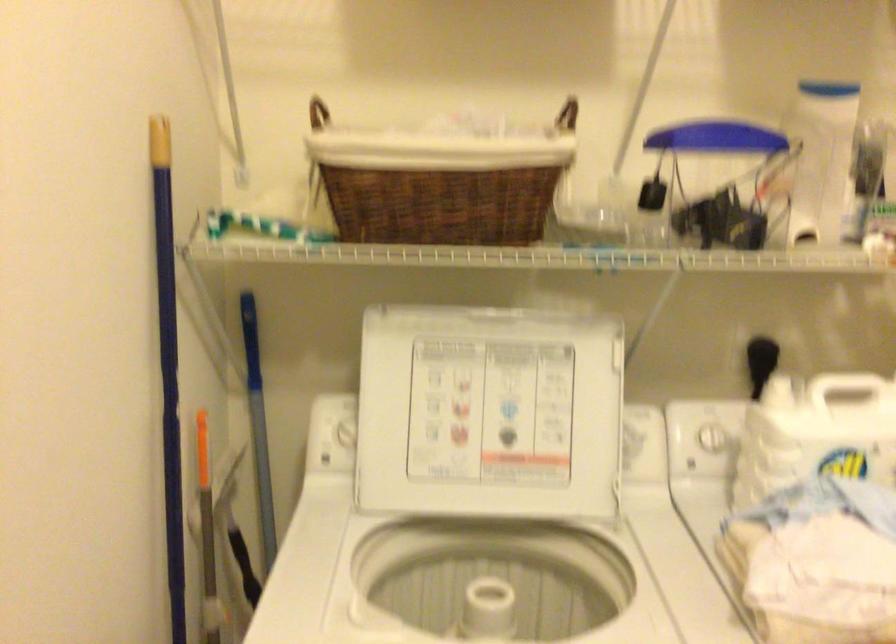
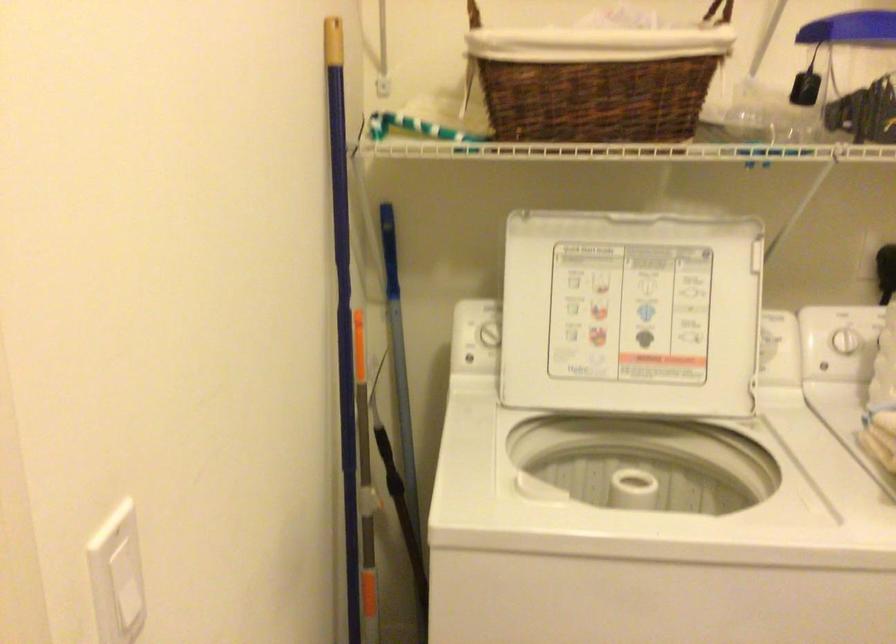
Question: The camera is either moving clockwise (left) or counter-clockwise (right) around the object. The first image is from the beginning of the video and the second image is from the end. Is the camera moving left or right when shooting the video?

Choices:
 (A) Left
 (B) Right

Answer: (B)